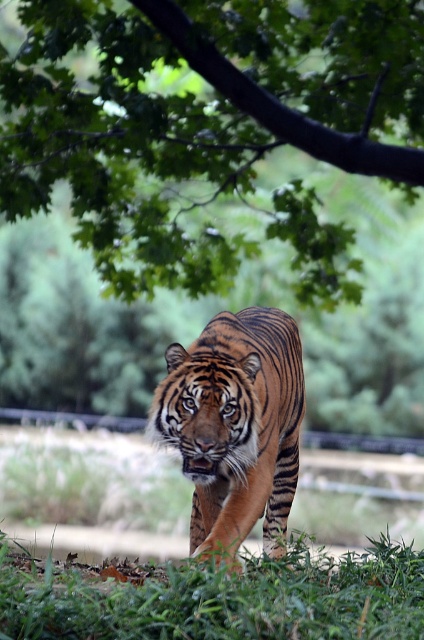
Question: Is the position of green grass at lower center less distant than that of orange-brown striped tiger at center?

Choices:
 (A) no
 (B) yes

Answer: (B)

Question: Is green leafy tree at upper center below orange-brown striped tiger at center?

Choices:
 (A) yes
 (B) no

Answer: (B)

Question: Can you confirm if green leafy tree at upper center is positioned above green grass at lower center?

Choices:
 (A) no
 (B) yes

Answer: (B)

Question: Which point is closer to the camera?

Choices:
 (A) green grass at lower center
 (B) orange-brown striped tiger at center

Answer: (A)

Question: Which of these objects is positioned farthest from the orange-brown striped tiger at center?

Choices:
 (A) green leafy tree at upper center
 (B) green grass at lower center

Answer: (A)

Question: Which of the following is the closest to the observer?

Choices:
 (A) (201, 380)
 (B) (412, 548)
 (C) (84, 106)

Answer: (A)